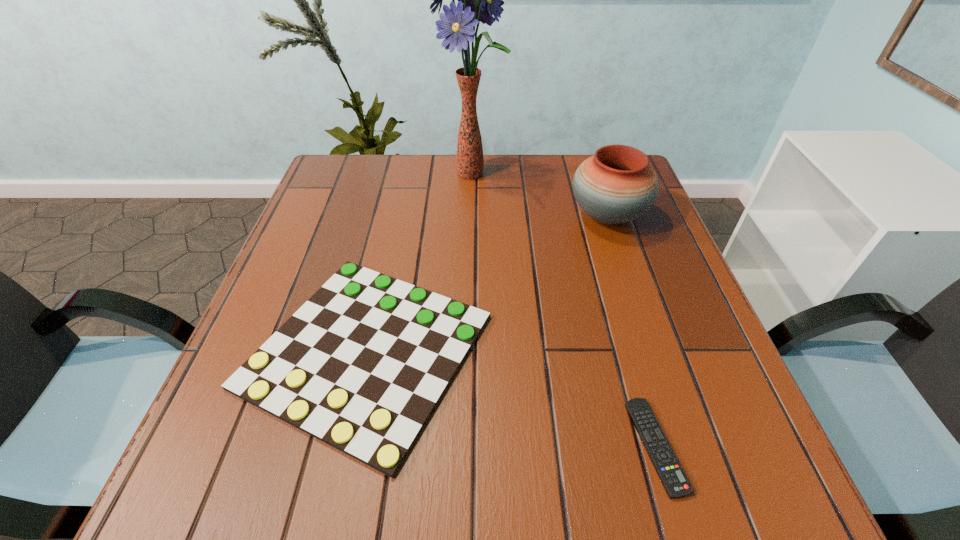
Locate an element on the screen. free space between the checkerboard and the shortest object is located at coordinates (511, 398).

This screenshot has height=540, width=960. In order to click on free point between the remote control and the checkerboard in this screenshot , I will do `click(511, 398)`.

Find the location of a particular element. vacant space in between the flower arrangement and the shortest object is located at coordinates (564, 310).

Where is `object that stands as the second closest to the pottery`? The image size is (960, 540). object that stands as the second closest to the pottery is located at coordinates (361, 365).

Where is `object that is the third closest one to the shortest object`? Image resolution: width=960 pixels, height=540 pixels. object that is the third closest one to the shortest object is located at coordinates (479, 0).

This screenshot has height=540, width=960. Find the location of `vacant space that satisfies the following two spatial constraints: 1. on the front side of the pottery; 2. on the left side of the tallest object`. vacant space that satisfies the following two spatial constraints: 1. on the front side of the pottery; 2. on the left side of the tallest object is located at coordinates (471, 216).

Locate an element on the screen. Image resolution: width=960 pixels, height=540 pixels. vacant space that satisfies the following two spatial constraints: 1. on the front side of the checkerboard; 2. on the right side of the shortest object is located at coordinates (346, 446).

Locate an element on the screen. Image resolution: width=960 pixels, height=540 pixels. free spot that satisfies the following two spatial constraints: 1. on the front side of the shortest object; 2. on the right side of the flower arrangement is located at coordinates (467, 446).